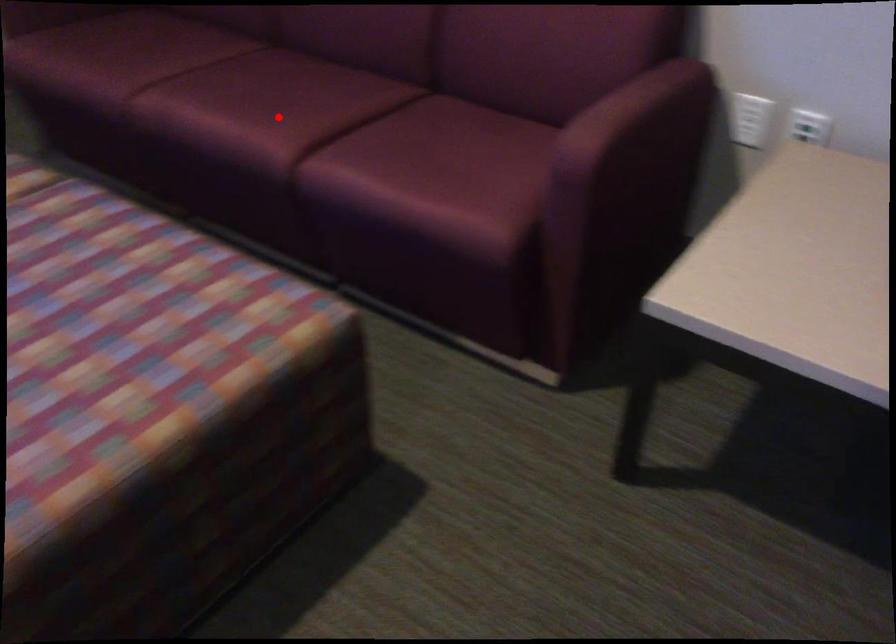
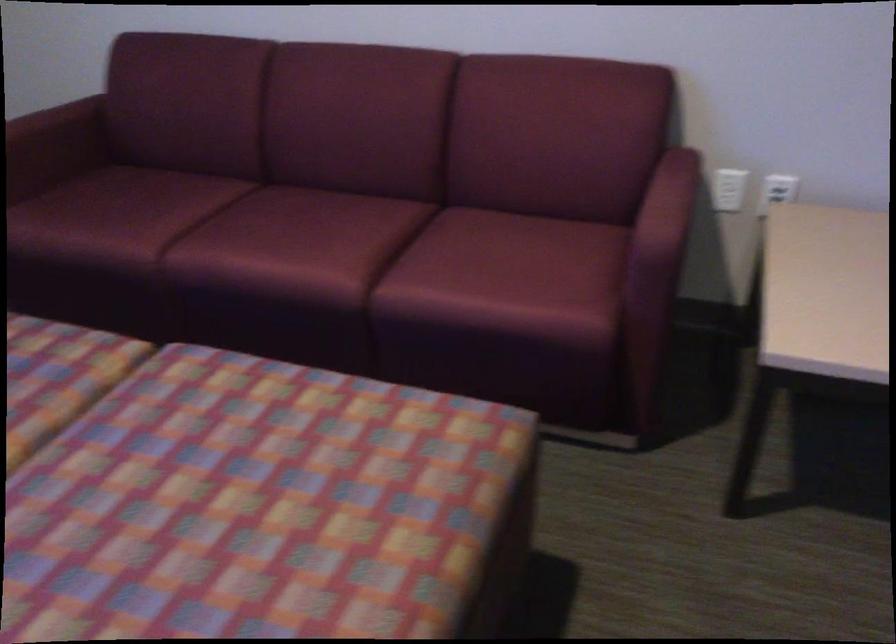
In the second image, find the point that corresponds to the highlighted location in the first image.

(332, 249)